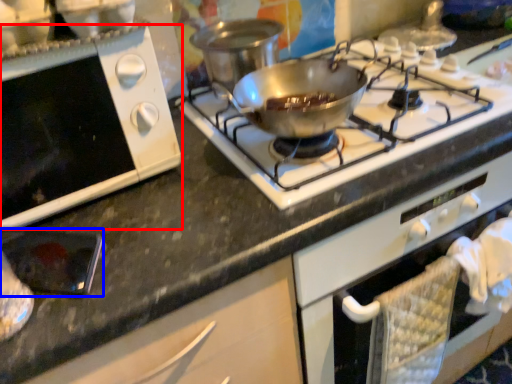
Question: Which object is further to the camera taking this photo, oven (highlighted by a red box) or appliance (highlighted by a blue box)?

Choices:
 (A) oven
 (B) appliance

Answer: (B)